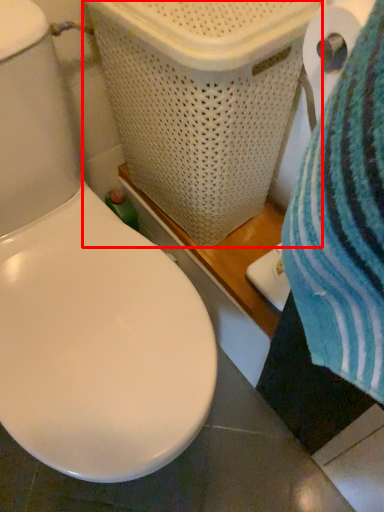
Question: From the image's perspective, where is laundry basket (annotated by the red box) located in relation to toilet paper in the image?

Choices:
 (A) above
 (B) below

Answer: (A)